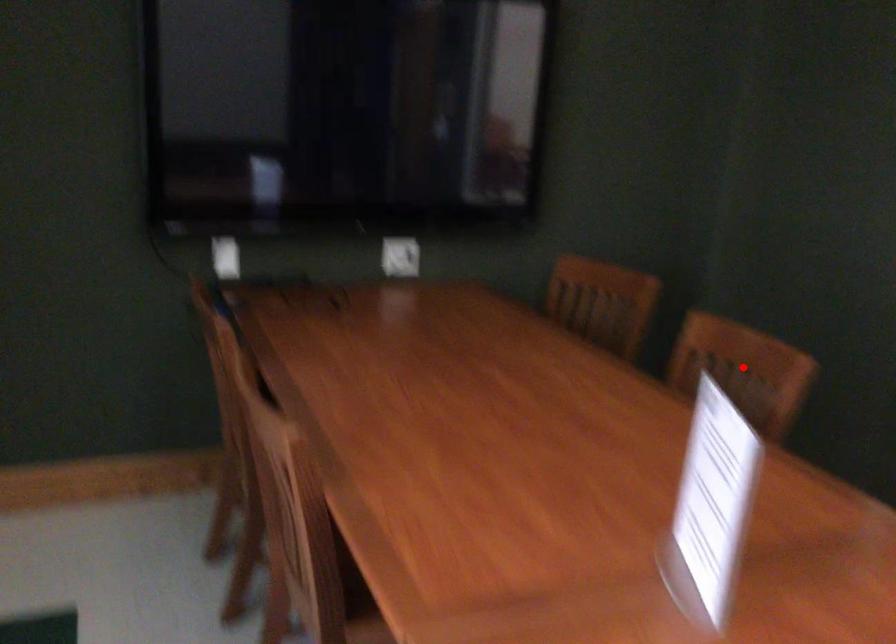
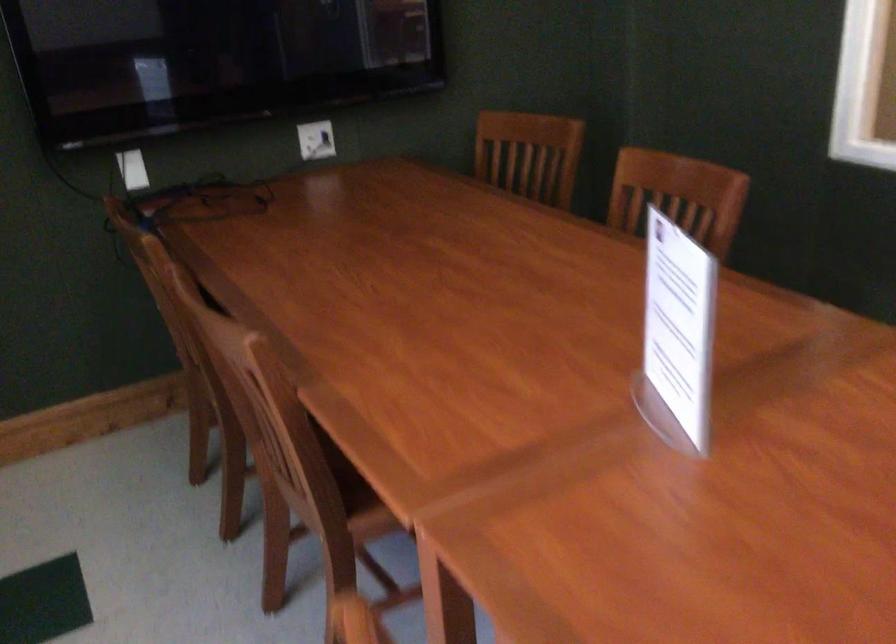
Locate, in the second image, the point that corresponds to the highlighted location in the first image.

(677, 196)